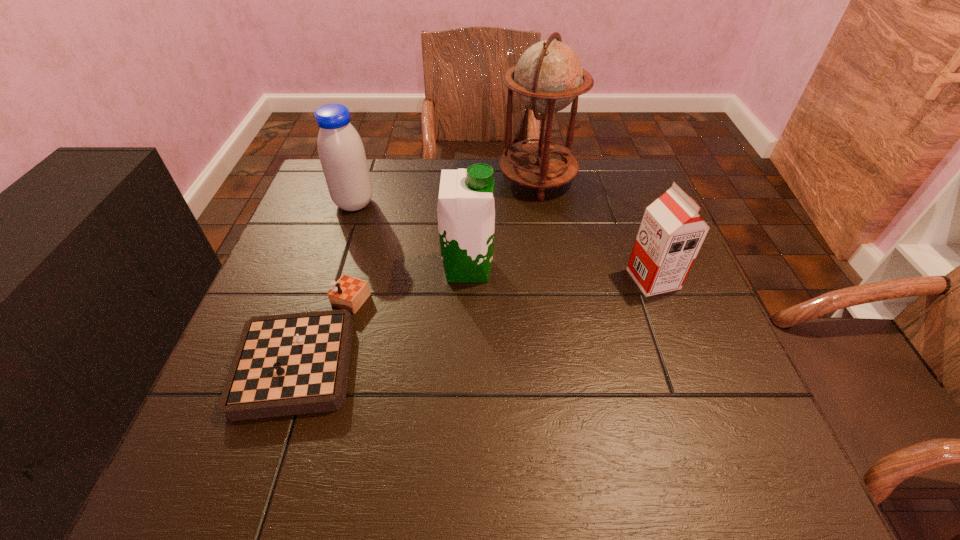
Locate an element on the screen. Image resolution: width=960 pixels, height=540 pixels. globe is located at coordinates pos(547,78).

Where is `the second object from right to left`? the second object from right to left is located at coordinates (547, 78).

The image size is (960, 540). I want to click on the farthest soya milk, so [x=342, y=155].

Identify the location of the third object from right to left. Image resolution: width=960 pixels, height=540 pixels. (466, 211).

Where is `the rightmost soya milk`? This screenshot has height=540, width=960. the rightmost soya milk is located at coordinates (671, 233).

You are a GUI agent. You are given a task and a screenshot of the screen. Output one action in this format:
    pyautogui.click(x=<x>, y=<y>)
    Task: Click on the shortest object
    The height and width of the screenshot is (540, 960).
    Given the screenshot: What is the action you would take?
    pyautogui.click(x=289, y=364)

Identify the location of free space located on the surface of the second object from right to left. (474, 179).

I want to click on vacant space located on the surface of the second object from right to left, so click(x=425, y=179).

Where is `vacant position located 0.400m on the surface of the second object from right to left`? vacant position located 0.400m on the surface of the second object from right to left is located at coordinates (359, 179).

At what (x,y) coordinates should I click in order to perform the action: click on free spot located 0.120m on the front of the farthest soya milk. Please return your answer as a coordinate pair (x, y). Image resolution: width=960 pixels, height=540 pixels. Looking at the image, I should click on (340, 247).